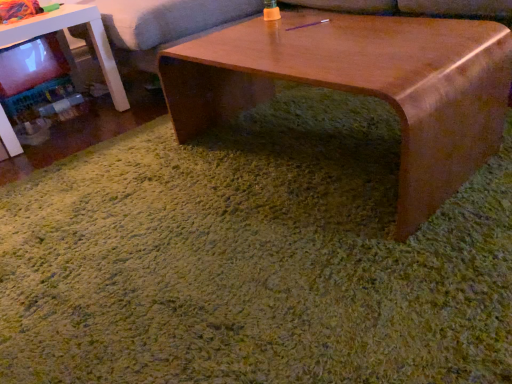
Question: Considering the relative sizes of soft gray couch at upper center and white glossy table at left in the image provided, is soft gray couch at upper center thinner than white glossy table at left?

Choices:
 (A) no
 (B) yes

Answer: (A)

Question: From a real-world perspective, is soft gray couch at upper center on white glossy table at left?

Choices:
 (A) yes
 (B) no

Answer: (A)

Question: Does soft gray couch at upper center have a greater width compared to white glossy table at left?

Choices:
 (A) no
 (B) yes

Answer: (B)

Question: Does soft gray couch at upper center appear on the left side of white glossy table at left?

Choices:
 (A) yes
 (B) no

Answer: (B)

Question: Does soft gray couch at upper center turn towards white glossy table at left?

Choices:
 (A) no
 (B) yes

Answer: (B)

Question: Based on their sizes in the image, would you say wooden coffee table at center is bigger or smaller than soft gray couch at upper center?

Choices:
 (A) small
 (B) big

Answer: (A)

Question: Based on their positions, is wooden coffee table at center located to the left or right of soft gray couch at upper center?

Choices:
 (A) right
 (B) left

Answer: (A)

Question: Does point (475, 150) appear closer or farther from the camera than point (493, 6)?

Choices:
 (A) closer
 (B) farther

Answer: (A)

Question: Is wooden coffee table at center wider or thinner than soft gray couch at upper center?

Choices:
 (A) wide
 (B) thin

Answer: (B)

Question: Relative to white glossy table at left, is soft gray couch at upper center in front or behind?

Choices:
 (A) behind
 (B) front

Answer: (A)

Question: From the image's perspective, is soft gray couch at upper center located above or below white glossy table at left?

Choices:
 (A) below
 (B) above

Answer: (B)

Question: Considering the positions of soft gray couch at upper center and white glossy table at left in the image, is soft gray couch at upper center bigger or smaller than white glossy table at left?

Choices:
 (A) big
 (B) small

Answer: (A)

Question: Is soft gray couch at upper center wider or thinner than white glossy table at left?

Choices:
 (A) thin
 (B) wide

Answer: (B)

Question: Would you say white glossy table at left is inside or outside wooden coffee table at center?

Choices:
 (A) outside
 (B) inside

Answer: (A)

Question: Considering the positions of white glossy table at left and wooden coffee table at center in the image, is white glossy table at left bigger or smaller than wooden coffee table at center?

Choices:
 (A) small
 (B) big

Answer: (A)